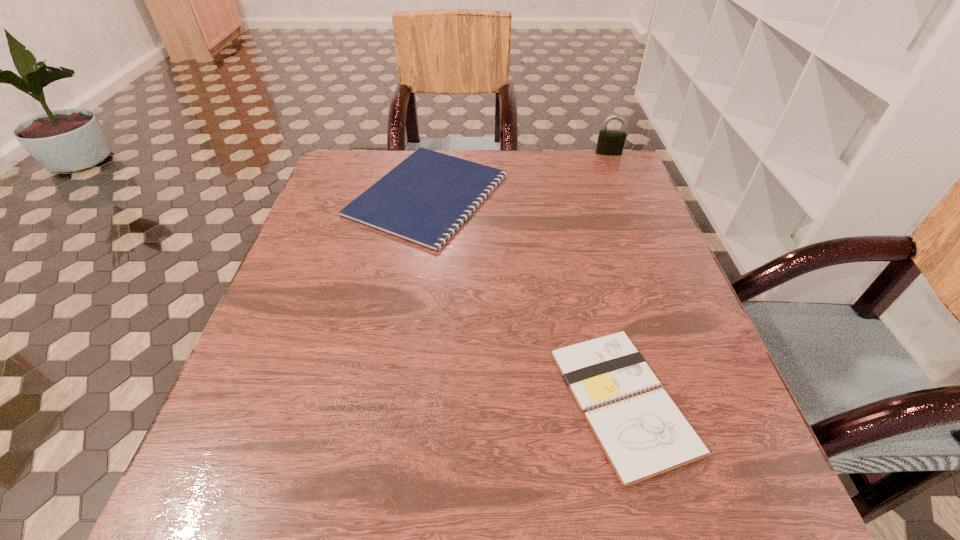
This screenshot has width=960, height=540. I want to click on padlock, so click(x=611, y=143).

The height and width of the screenshot is (540, 960). I want to click on the farther notepad, so click(x=424, y=199).

The image size is (960, 540). In order to click on the leftmost object in this screenshot , I will do `click(424, 199)`.

Find the location of a particular element. the nearer notepad is located at coordinates (642, 436).

The image size is (960, 540). What are the coordinates of `the right notepad` in the screenshot? It's located at (642, 436).

The image size is (960, 540). Find the location of `vacant area situated on the left of the tallest object`. vacant area situated on the left of the tallest object is located at coordinates (x=516, y=153).

Where is `blank area located 0.100m on the right of the left notepad`? blank area located 0.100m on the right of the left notepad is located at coordinates (546, 194).

The image size is (960, 540). I want to click on free space located on the back of the nearer notepad, so click(575, 211).

You are a GUI agent. You are given a task and a screenshot of the screen. Output one action in this format:
    pyautogui.click(x=<x>, y=<y>)
    Task: Click on the padlock that is at the far edge
    The image size is (960, 540).
    Given the screenshot: What is the action you would take?
    pyautogui.click(x=611, y=143)

Image resolution: width=960 pixels, height=540 pixels. Identify the location of notepad located at the far edge. (424, 199).